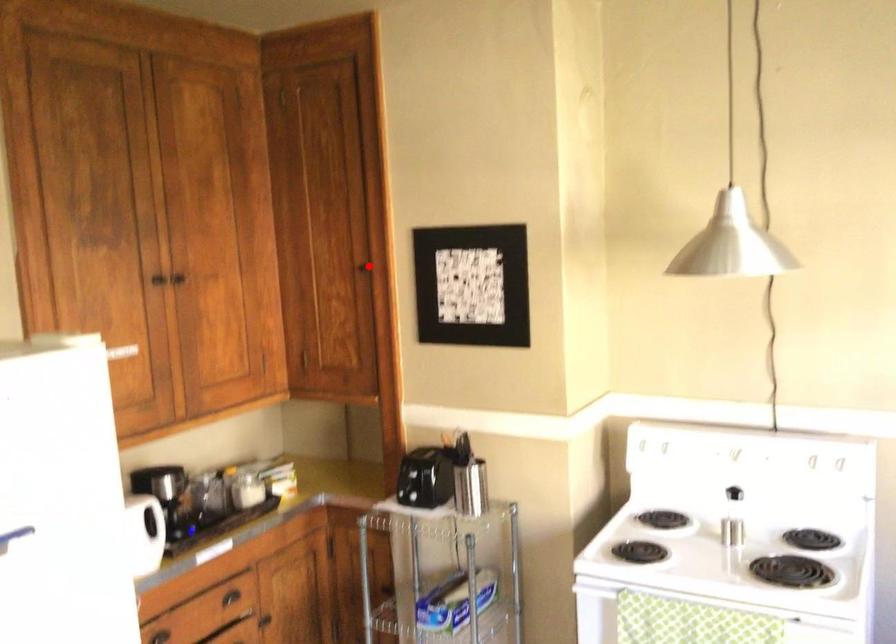
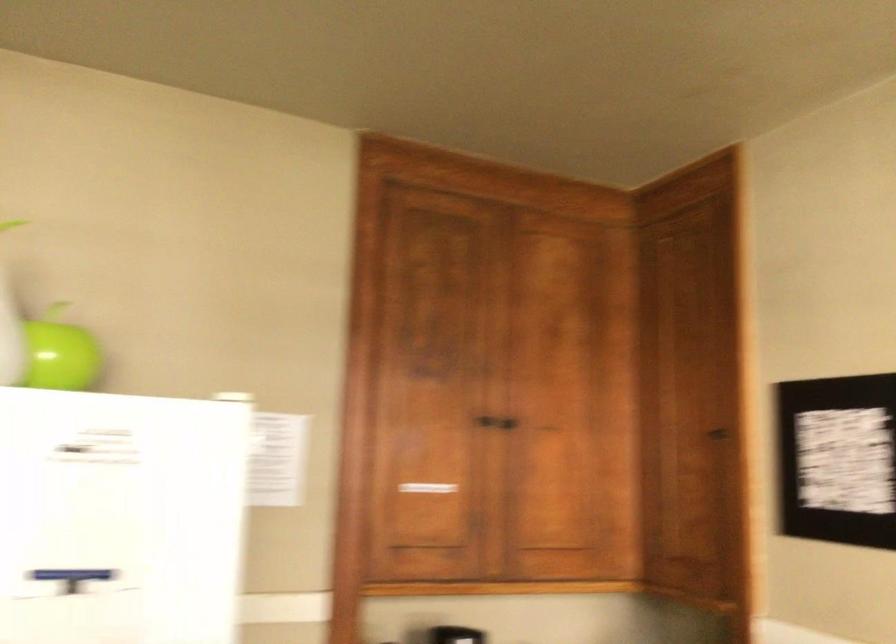
Locate, in the second image, the point that corresponds to the highlighted location in the first image.

(719, 436)